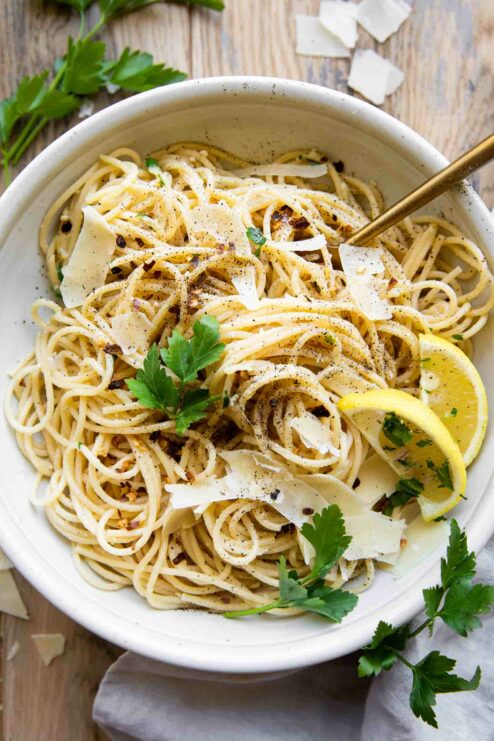
The height and width of the screenshot is (741, 494). I want to click on fork, so click(442, 175).